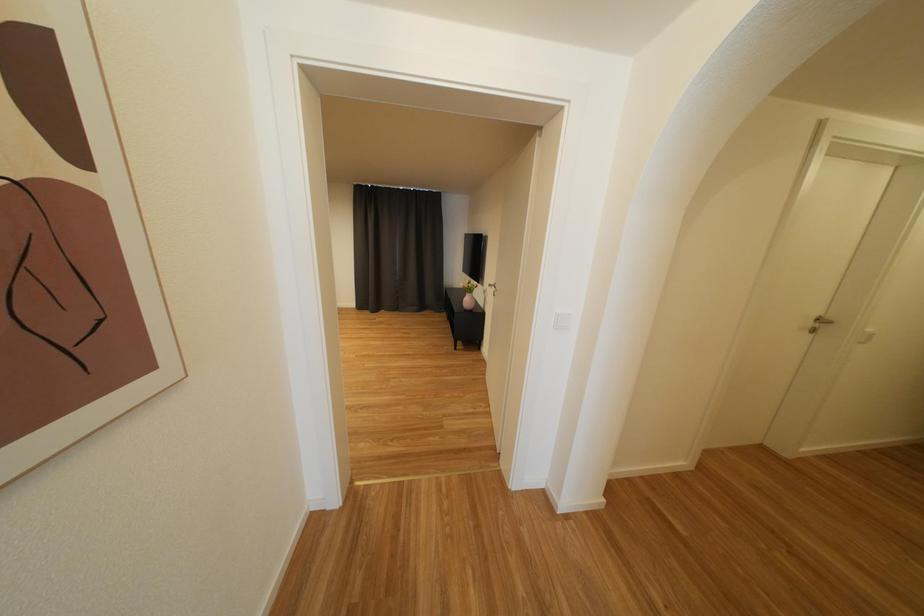
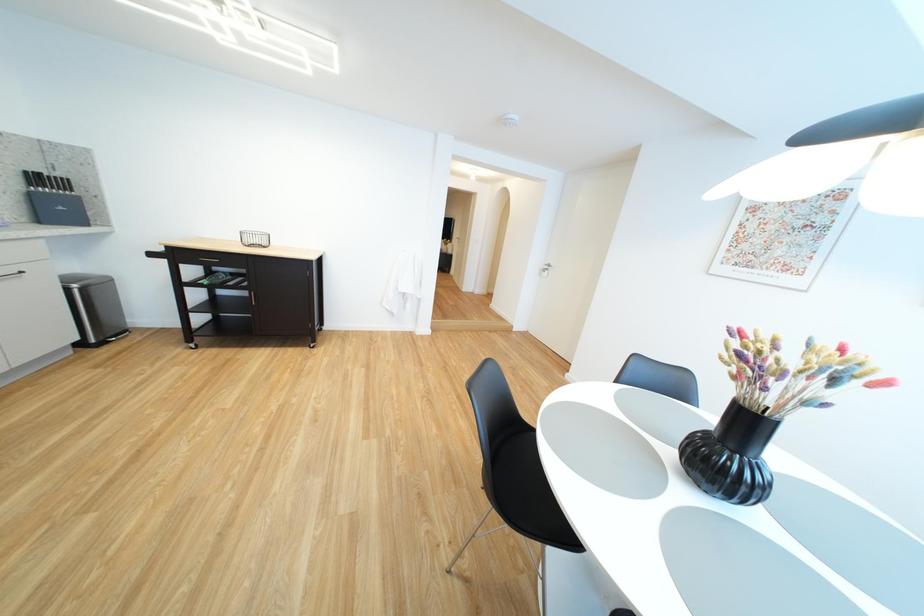
Question: In a continuous first-person perspective shot, in which direction is the camera moving?

Choices:
 (A) Left
 (B) Right
 (C) Forward
 (D) Backward

Answer: (D)